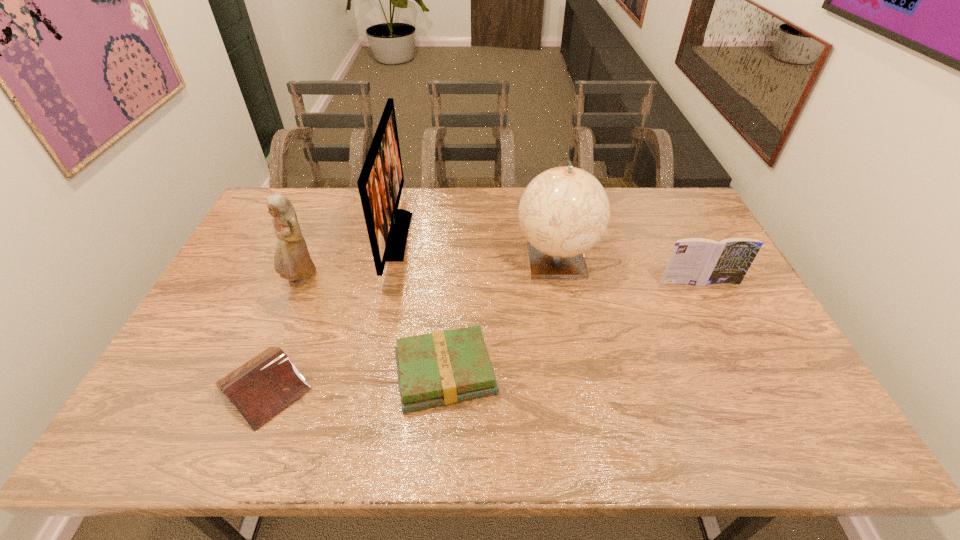
At what (x,y) coordinates should I click in order to perform the action: click on monitor. Please return your answer as a coordinate pair (x, y). The image size is (960, 540). Looking at the image, I should click on (380, 184).

Find the location of `the fifth object from left to right`. the fifth object from left to right is located at coordinates (564, 211).

Locate an element on the screen. This screenshot has width=960, height=540. figurine is located at coordinates (292, 260).

This screenshot has height=540, width=960. In order to click on the tallest book in this screenshot , I will do `click(694, 261)`.

This screenshot has width=960, height=540. I want to click on the rightmost book, so click(694, 261).

Where is `the leftmost book`? This screenshot has height=540, width=960. the leftmost book is located at coordinates (265, 385).

Find the location of a particular element. the second book from right to left is located at coordinates (441, 368).

Where is `vacant area situated on the front-facing side of the third object from left to right`? vacant area situated on the front-facing side of the third object from left to right is located at coordinates (525, 236).

Where is `free region located 0.120m on the surface of the globe showing Europe and Africa`? free region located 0.120m on the surface of the globe showing Europe and Africa is located at coordinates (567, 321).

Locate an element on the screen. The image size is (960, 540). vacant space located on the front-facing side of the figurine is located at coordinates (285, 319).